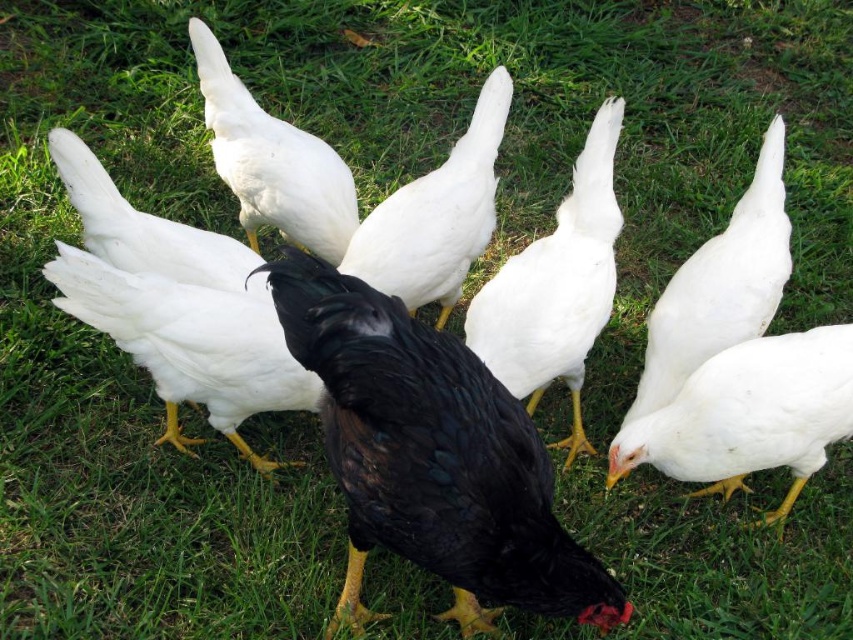
From the picture: Does black glossy chicken at center have a greater height compared to white matte chicken at upper left?

Yes.

Is black glossy chicken at center smaller than white matte chicken at upper left?

No.

At what (x,y) coordinates should I click in order to perform the action: click on black glossy chicken at center. Please return your answer as a coordinate pair (x, y). This screenshot has width=853, height=640. Looking at the image, I should click on (432, 458).

Locate an element on the screen. black glossy chicken at center is located at coordinates (432, 458).

Between white matte chicken at lower right and white matte feathers at right, which one appears on the right side from the viewer's perspective?

Positioned to the right is white matte chicken at lower right.

Between white matte chicken at lower right and white matte feathers at right, which one has less height?

white matte chicken at lower right is shorter.

Which is in front, point (611, 474) or point (769, 284)?

Point (611, 474) is in front.

What are the coordinates of `white matte chicken at lower right` in the screenshot? It's located at pyautogui.click(x=749, y=416).

Who is more distant from viewer, (x=474, y=586) or (x=511, y=332)?

The point (x=511, y=332) is more distant.

Is point (311, 369) positioned before point (585, 244)?

Yes, it is in front of point (585, 244).

Is point (416, 387) positioned after point (503, 323)?

That is False.

Find the location of a particular element. The image size is (853, 640). black glossy chicken at center is located at coordinates (432, 458).